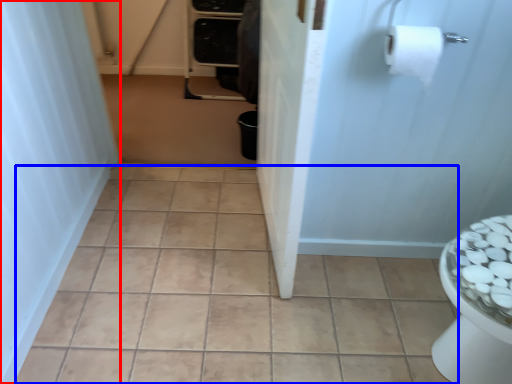
Question: Among these objects, which one is farthest to the camera, shower curtain (highlighted by a red box) or ceramic tile (highlighted by a blue box)?

Choices:
 (A) shower curtain
 (B) ceramic tile

Answer: (B)